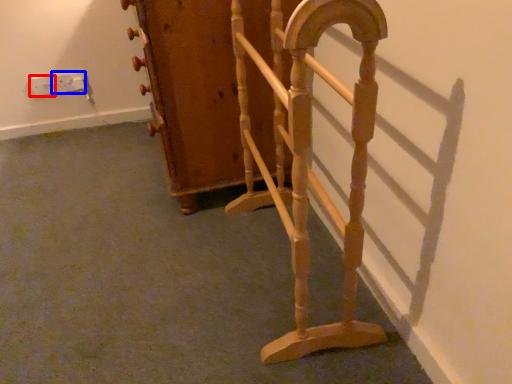
Question: Which object is closer to the camera taking this photo, electric outlet (highlighted by a red box) or electric outlet (highlighted by a blue box)?

Choices:
 (A) electric outlet
 (B) electric outlet

Answer: (A)